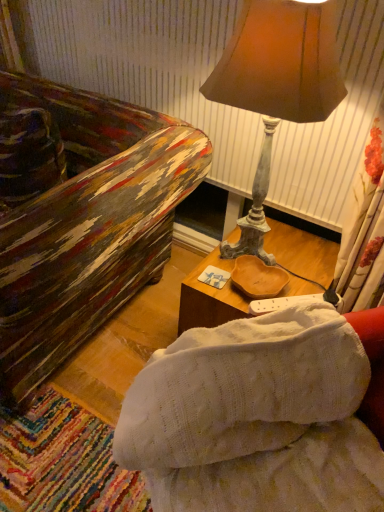
Identify the location of free spot above wooden tray at center (from a real-world perspective). (281, 265).